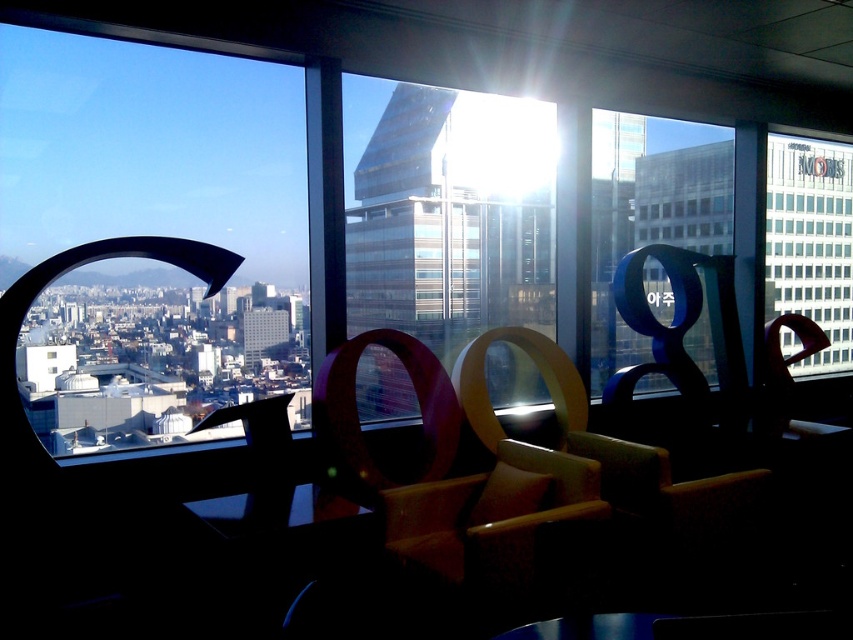
Based on the scene, where is the transparent glass building at center located in the image?

The transparent glass building at center is located at point (451, 218).

You are standing in the modern office space described. You notice a point marked at coordinates (x=144, y=228). Based on the scene, what object is located at this point?

The point at coordinates (x=144, y=228) marks the transparent glass window at upper left.